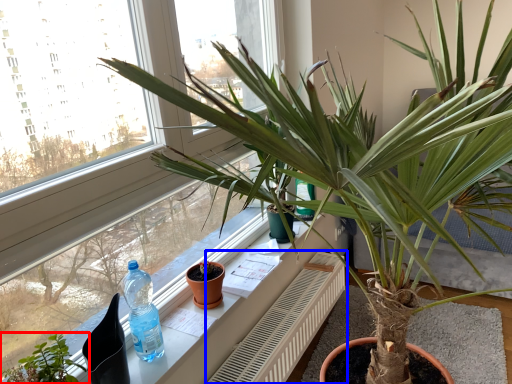
Question: Which object is closer to the camera taking this photo, houseplant (highlighted by a red box) or radiator (highlighted by a blue box)?

Choices:
 (A) houseplant
 (B) radiator

Answer: (A)